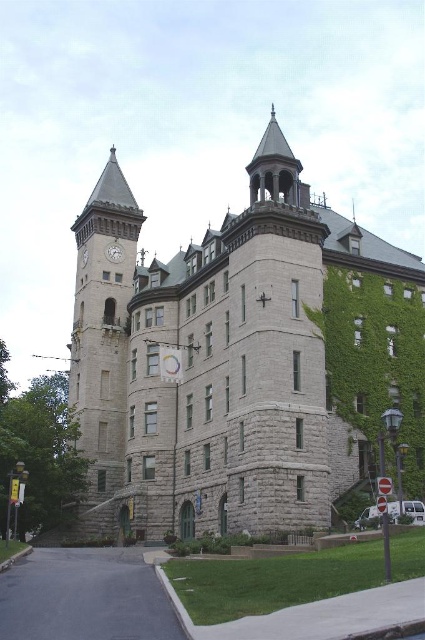
Can you confirm if gray stone clock tower at left is smaller than silver metallic clock at upper left?

Incorrect, gray stone clock tower at left is not smaller in size than silver metallic clock at upper left.

Does gray stone clock tower at left come in front of silver metallic clock at upper left?

Yes, gray stone clock tower at left is closer to the viewer.

Which is behind, point (102, 520) or point (116, 248)?

The point (116, 248) is behind.

Locate an element on the screen. The image size is (425, 640). gray stone clock tower at left is located at coordinates (102, 339).